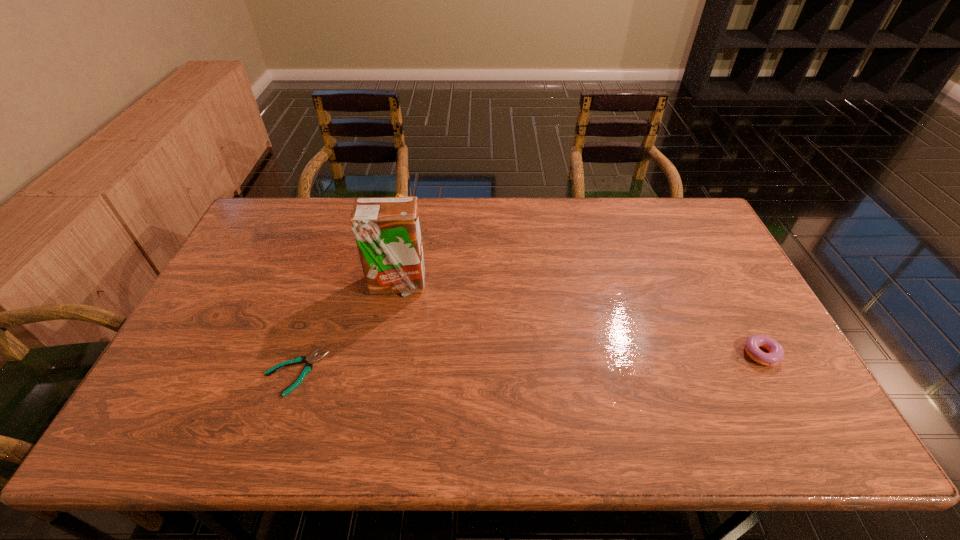
The height and width of the screenshot is (540, 960). What are the coordinates of `free space that satisfies the following two spatial constraints: 1. on the front side of the carton; 2. on the left side of the rightmost object` in the screenshot? It's located at (385, 356).